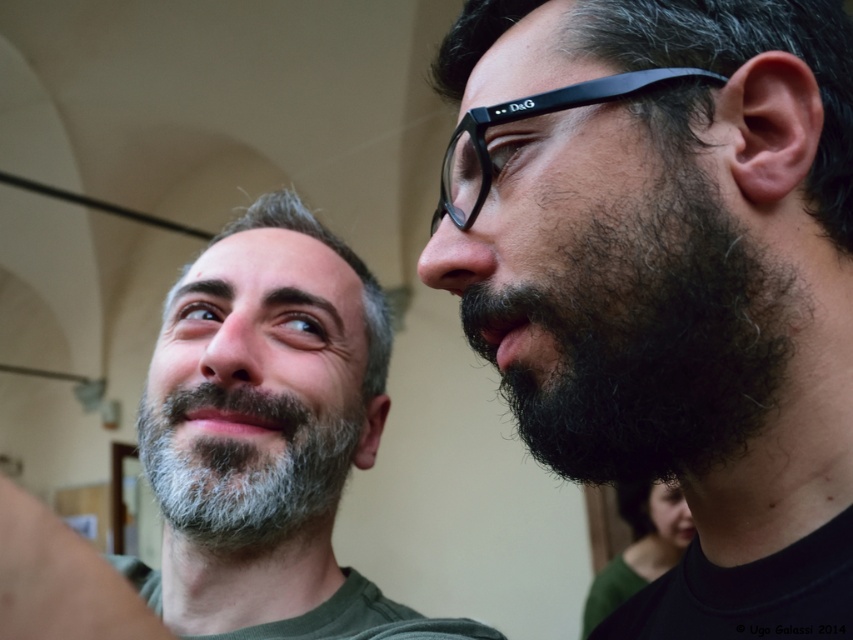
You are standing in the hallway and see the point at coordinates (267, 436). Which object in the scene does this point correspond to?

The point at coordinates (267, 436) corresponds to the gray beard at left.